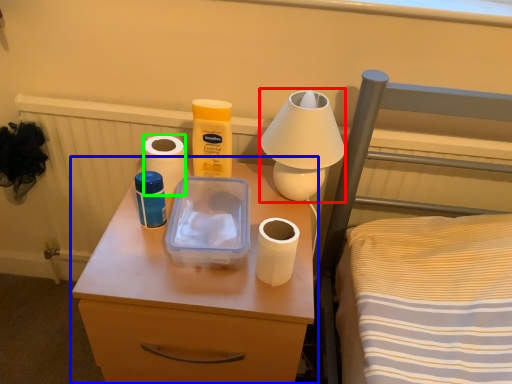
Question: Which is nearer to the table lamp (highlighted by a red box)? nightstand (highlighted by a blue box) or toilet paper (highlighted by a green box).

Choices:
 (A) nightstand
 (B) toilet paper

Answer: (B)